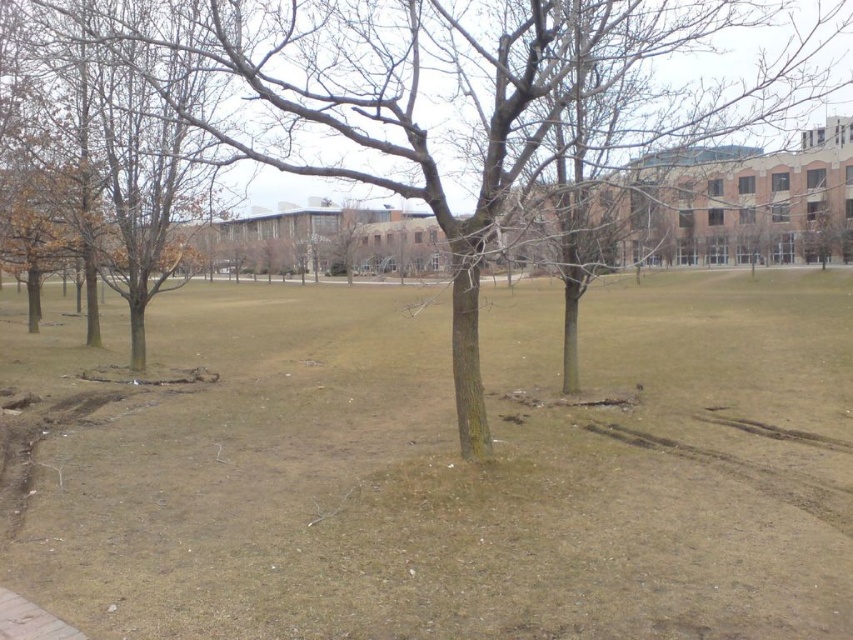
Who is positioned more to the left, brown dry grass at center or brown bark tree at center?

From the viewer's perspective, brown bark tree at center appears more on the left side.

Who is more distant from viewer, (231, 589) or (618, 64)?

The point (618, 64) is behind.

Between point (566, 433) and point (438, 198), which one is positioned behind?

Point (566, 433)

Locate an element on the screen. brown dry grass at center is located at coordinates (466, 474).